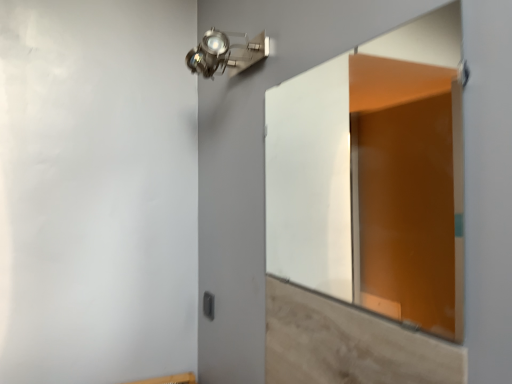
Question: Does transparent glass door at center have a lesser height compared to metallic spot light at upper center?

Choices:
 (A) yes
 (B) no

Answer: (B)

Question: From the image's perspective, is transparent glass door at center on top of metallic spot light at upper center?

Choices:
 (A) yes
 (B) no

Answer: (B)

Question: Considering the relative positions of transparent glass door at center and metallic spot light at upper center in the image provided, is transparent glass door at center in front of metallic spot light at upper center?

Choices:
 (A) yes
 (B) no

Answer: (A)

Question: Considering the relative sizes of transparent glass door at center and metallic spot light at upper center in the image provided, is transparent glass door at center smaller than metallic spot light at upper center?

Choices:
 (A) yes
 (B) no

Answer: (B)

Question: Can you confirm if transparent glass door at center is positioned to the right of metallic spot light at upper center?

Choices:
 (A) no
 (B) yes

Answer: (B)

Question: Looking at their shapes, would you say transparent glass door at center is wider or thinner than light brown wood at lower right?

Choices:
 (A) wide
 (B) thin

Answer: (A)

Question: From the image's perspective, is transparent glass door at center above or below light brown wood at lower right?

Choices:
 (A) below
 (B) above

Answer: (B)

Question: In terms of height, does transparent glass door at center look taller or shorter compared to light brown wood at lower right?

Choices:
 (A) short
 (B) tall

Answer: (B)

Question: Looking at the image, does transparent glass door at center seem bigger or smaller compared to light brown wood at lower right?

Choices:
 (A) small
 (B) big

Answer: (B)

Question: From a real-world perspective, is light brown wood at lower right above or below transparent glass door at center?

Choices:
 (A) below
 (B) above

Answer: (A)

Question: In terms of size, does light brown wood at lower right appear bigger or smaller than transparent glass door at center?

Choices:
 (A) small
 (B) big

Answer: (A)

Question: Considering their positions, is light brown wood at lower right located in front of or behind transparent glass door at center?

Choices:
 (A) front
 (B) behind

Answer: (A)

Question: From the image's perspective, is light brown wood at lower right above or below transparent glass door at center?

Choices:
 (A) above
 (B) below

Answer: (B)

Question: Would you say black plastic switch at lower center is inside or outside metallic spot light at upper center?

Choices:
 (A) inside
 (B) outside

Answer: (B)

Question: Considering the positions of black plastic switch at lower center and metallic spot light at upper center in the image, is black plastic switch at lower center bigger or smaller than metallic spot light at upper center?

Choices:
 (A) big
 (B) small

Answer: (B)